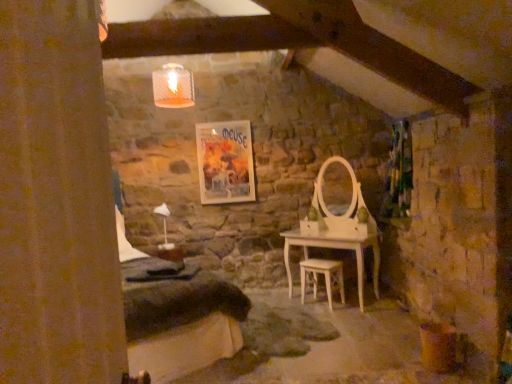
Question: Is light wood stool at center wider or thinner than green floral fabric curtain at right, positioned as the second curtain in left-to-right order?

Choices:
 (A) thin
 (B) wide

Answer: (A)

Question: Is light wood stool at center taller or shorter than green floral fabric curtain at right, positioned as the second curtain in left-to-right order?

Choices:
 (A) short
 (B) tall

Answer: (A)

Question: Estimate the real-world distances between objects in this image. Which object is closer to the green floral fabric curtain at right, which is the 2th curtain in front-to-back order?

Choices:
 (A) brown textured curtain at left, the first curtain when ordered from front to back
 (B) matte paper poster at center
 (C) light wood stool at center

Answer: (C)

Question: Which of these objects is positioned farthest from the brown textured curtain at left, arranged as the second curtain when viewed from the right?

Choices:
 (A) matte paper poster at center
 (B) green floral fabric curtain at right, which is counted as the 1th curtain, starting from the right
 (C) light wood stool at center

Answer: (A)